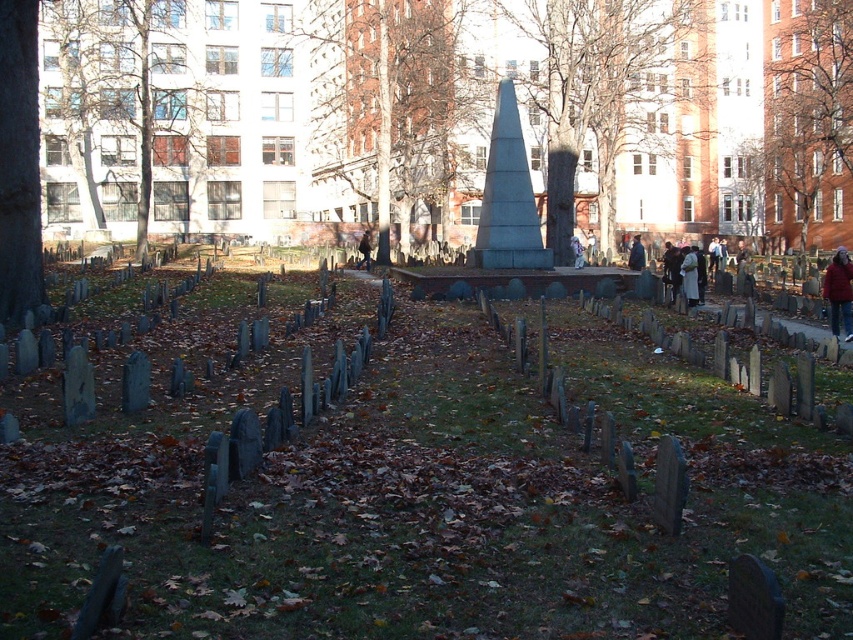
You are a visitor at the cemetery and want to place your jacket on an object. Which object would you choose between the wooden gravestones at center and the brown leather jacket at center, and why?

The wooden gravestones at center has a larger size compared to the brown leather jacket at center, so you should place your jacket on the wooden gravestones at center because it provides a stable and flat surface for placing the jacket.

You are a photographer planning to take a group photo of two people wearing the red fleece jacket at center and white cotton jacket at center. The photographer wants to ensure both subjects are visible in the frame. Considering their sizes, which jacket should be placed closer to the camera to make them appear the same size in the photo?

The red fleece jacket at center is larger in size than the white cotton jacket at center. To make them appear the same size in the photo, the smaller white cotton jacket at center should be placed closer to the camera while the larger red fleece jacket at center can be positioned further back.

You are visiting the cemetery and notice two jackets left on a bench at the center. You want to place both jackets side by side on a shelf that is 1.2 meters wide. Can both jackets fit if the red fleece jacket at center is placed first, followed by the white cotton jacket at center?

The red fleece jacket at center is wider than the white cotton jacket at center. If placed side by side, their combined width must be compared to the 1.2 meter shelf. However, without exact measurements, we cannot confirm if they fit. Please check the total width of both jackets.